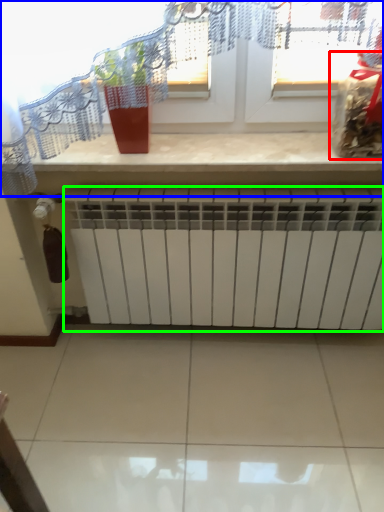
Question: Considering the real-world distances, which object is farthest from food (highlighted by a red box)? window (highlighted by a blue box) or radiator (highlighted by a green box)?

Choices:
 (A) window
 (B) radiator

Answer: (B)